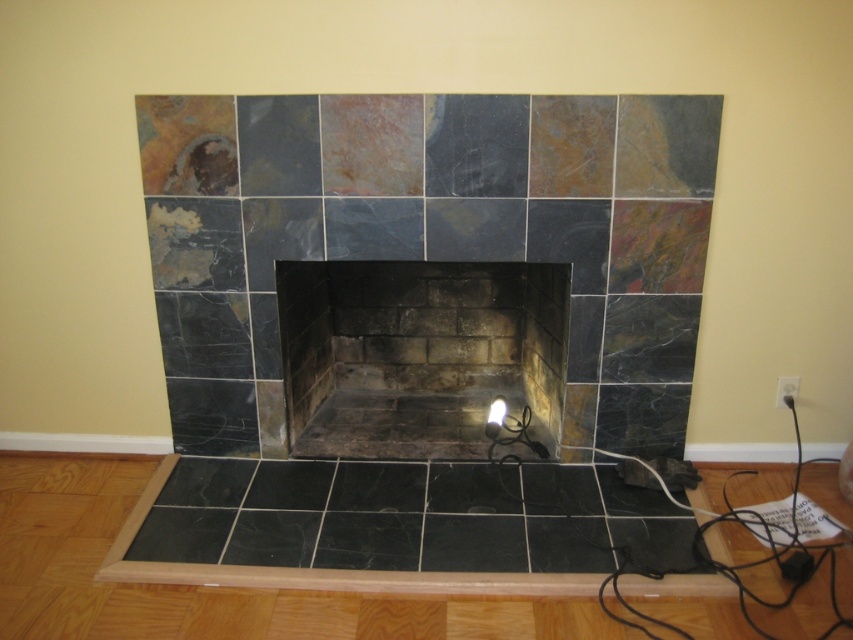
Between point (337, 332) and point (498, 397), which one is positioned in front?

Point (498, 397) is in front.

Between black slate fireplace at center and white glossy lampshade at center, which one has less height?

white glossy lampshade at center

Is point (412, 413) in front of point (488, 413)?

No, it is behind (488, 413).

Where is `black slate fireplace at center`? The width and height of the screenshot is (853, 640). black slate fireplace at center is located at coordinates (416, 353).

Which is above, black plastic plug at lower right or white glossy lampshade at center?

white glossy lampshade at center is higher up.

Does point (807, 556) come closer to viewer compared to point (496, 410)?

Yes, it is.

I want to click on black plastic plug at lower right, so click(x=798, y=566).

Which is below, white glossy lampshade at center or white plastic electric outlet at lower right?

Positioned lower is white glossy lampshade at center.

Which is behind, point (490, 413) or point (795, 376)?

Positioned behind is point (490, 413).

This screenshot has height=640, width=853. In order to click on white glossy lampshade at center in this screenshot , I will do 495,417.